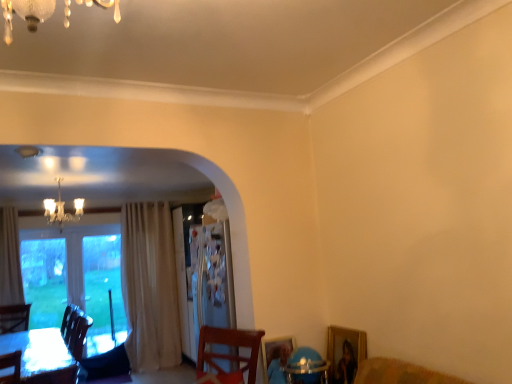
Locate an element on the screen. free location above gold-framed picture at lower right (from a real-world perspective) is located at coordinates (340, 324).